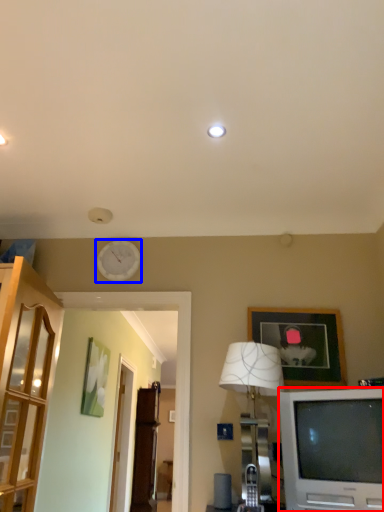
Question: Which of the following is the closest to the observer, television (highlighted by a red box) or clock (highlighted by a blue box)?

Choices:
 (A) television
 (B) clock

Answer: (A)